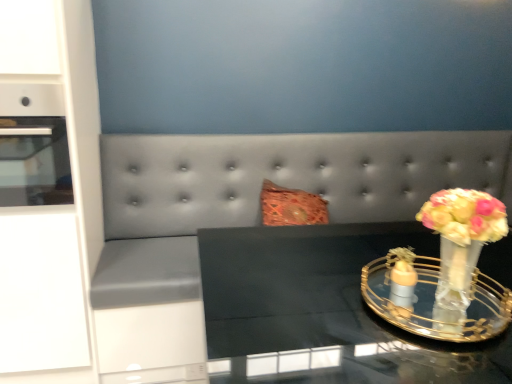
This screenshot has width=512, height=384. I want to click on free space in front of matte orange glass candle holder at right, the 1th candle holder positioned from the left, so click(411, 339).